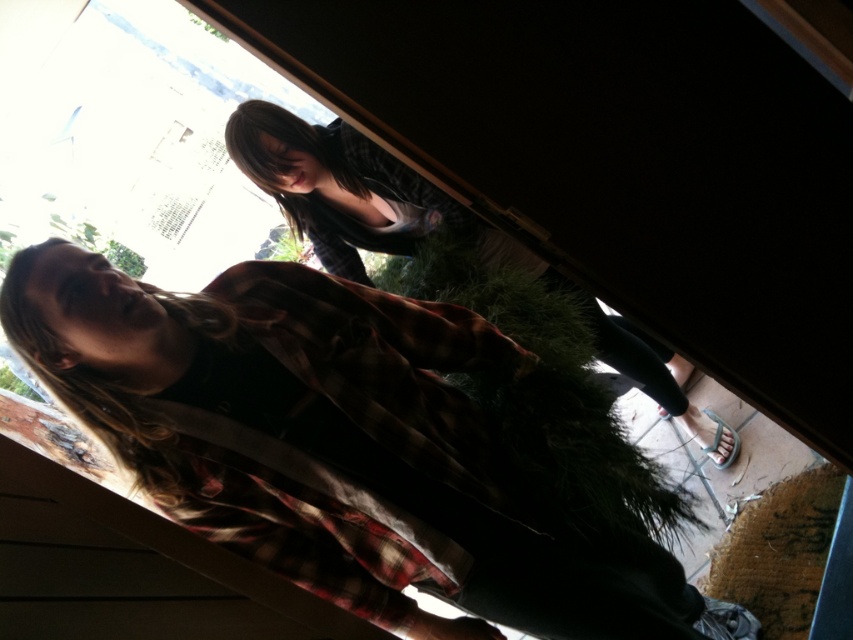
Question: Is flannel shirt at center above plaid flannel shirt at center?

Choices:
 (A) yes
 (B) no

Answer: (B)

Question: Which object appears farthest from the camera in this image?

Choices:
 (A) flannel shirt at center
 (B) plaid flannel shirt at center

Answer: (B)

Question: Which of the following is the farthest from the observer?

Choices:
 (A) plaid flannel shirt at center
 (B) flannel shirt at center

Answer: (A)

Question: Does flannel shirt at center have a greater width compared to plaid flannel shirt at center?

Choices:
 (A) yes
 (B) no

Answer: (B)

Question: Does flannel shirt at center appear under plaid flannel shirt at center?

Choices:
 (A) no
 (B) yes

Answer: (B)